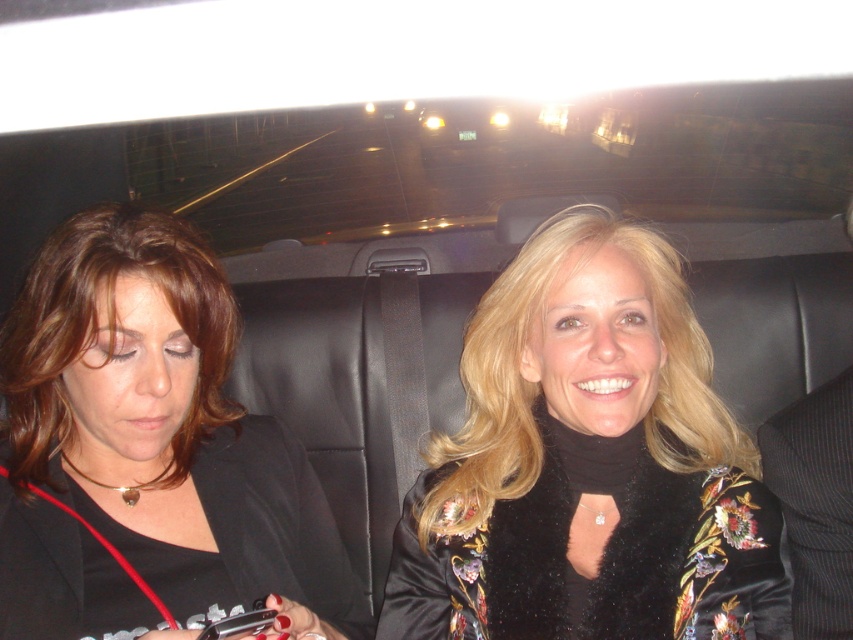
Does black velvet jacket at upper right have a lesser height compared to matte black jacket at left?

No.

Does black velvet jacket at upper right have a lesser width compared to matte black jacket at left?

No.

Is point (485, 380) more distant than point (22, 461)?

Yes, point (485, 380) is behind point (22, 461).

Locate an element on the screen. The width and height of the screenshot is (853, 640). black velvet jacket at upper right is located at coordinates (589, 467).